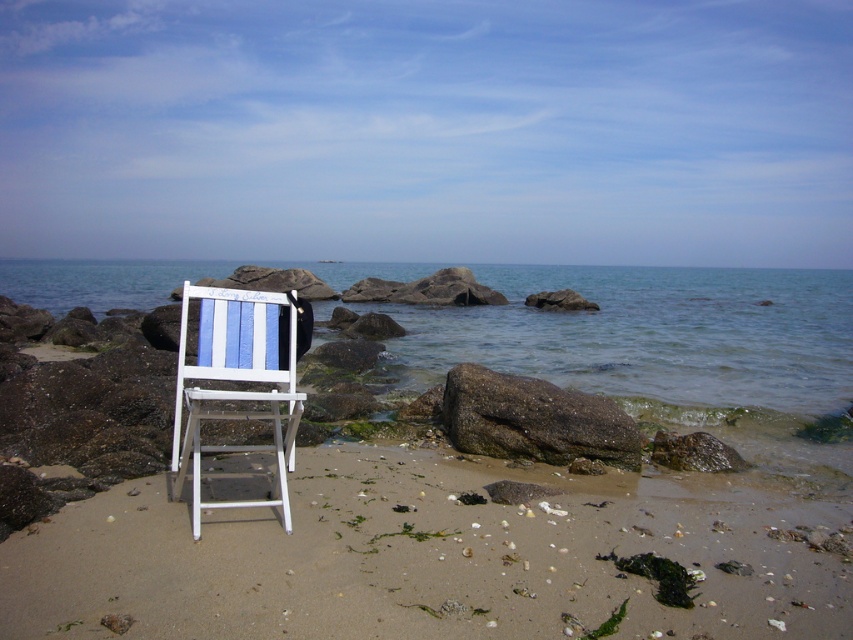
Is sandy brown at lower center shorter than rusty metallic rock at center?

Yes.

Describe the element at coordinates (421, 560) in the screenshot. The image size is (853, 640). I see `sandy brown at lower center` at that location.

Is point (764, 618) less distant than point (521, 452)?

Yes, it is in front of point (521, 452).

Find the location of a particular element. The width and height of the screenshot is (853, 640). sandy brown at lower center is located at coordinates (421, 560).

Does sandy brown at lower center appear on the right side of white wood chair at center?

Indeed, sandy brown at lower center is positioned on the right side of white wood chair at center.

Measure the distance from sandy brown at lower center to white wood chair at center.

sandy brown at lower center is 5.79 feet away from white wood chair at center.

Which is in front, point (379, 484) or point (184, 292)?

Point (184, 292) is more forward.

Find the location of `sandy brown at lower center`. sandy brown at lower center is located at coordinates (421, 560).

This screenshot has height=640, width=853. Describe the element at coordinates (236, 380) in the screenshot. I see `white wood chair at center` at that location.

Does white wood chair at center have a greater height compared to rusty metallic rock at center?

Correct, white wood chair at center is much taller as rusty metallic rock at center.

Is point (242, 416) closer to camera compared to point (618, 438)?

That is True.

Locate an element on the screen. white wood chair at center is located at coordinates (236, 380).